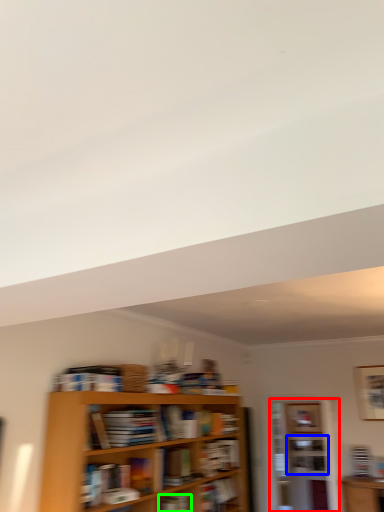
Question: Considering the real-world distances, which object is farthest from shelf (highlighted by a red box)? cabinet (highlighted by a blue box) or book (highlighted by a green box)?

Choices:
 (A) cabinet
 (B) book

Answer: (B)